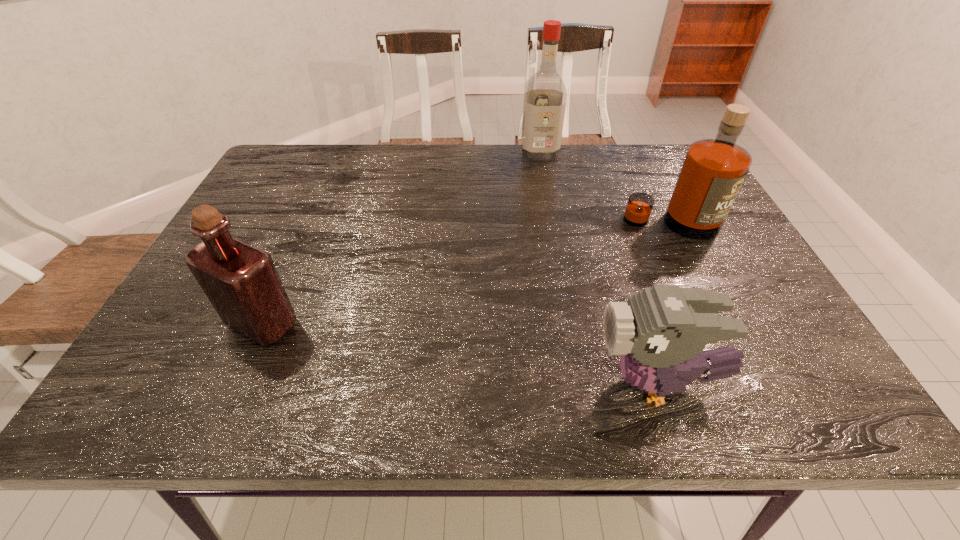
You are a GUI agent. You are given a task and a screenshot of the screen. Output one action in this format:
    pyautogui.click(x=<x>, y=<y>)
    Task: Click on the tallest object
    
    Given the screenshot: What is the action you would take?
    pyautogui.click(x=545, y=96)

At what (x,y) coordinates should I click in order to perform the action: click on the farthest liquor. Please return your answer as a coordinate pair (x, y). Looking at the image, I should click on (545, 96).

Where is `the second farthest liquor`? The width and height of the screenshot is (960, 540). the second farthest liquor is located at coordinates (713, 171).

The image size is (960, 540). What are the coordinates of `the rightmost liquor` in the screenshot? It's located at (713, 171).

What are the coordinates of `the leftmost liquor` in the screenshot? It's located at (242, 283).

At what (x,y) coordinates should I click in order to perform the action: click on the leftmost object. Please return your answer as a coordinate pair (x, y). The width and height of the screenshot is (960, 540). Looking at the image, I should click on (242, 283).

In order to click on the nearest object in this screenshot , I will do `click(660, 332)`.

Find the location of a particular element. the shortest object is located at coordinates (660, 332).

Locate an element on the screen. vacant space located on the front-facing side of the tallest object is located at coordinates (546, 191).

Find the location of `vacant space positioned on the front label of the rightmost liquor`. vacant space positioned on the front label of the rightmost liquor is located at coordinates (711, 305).